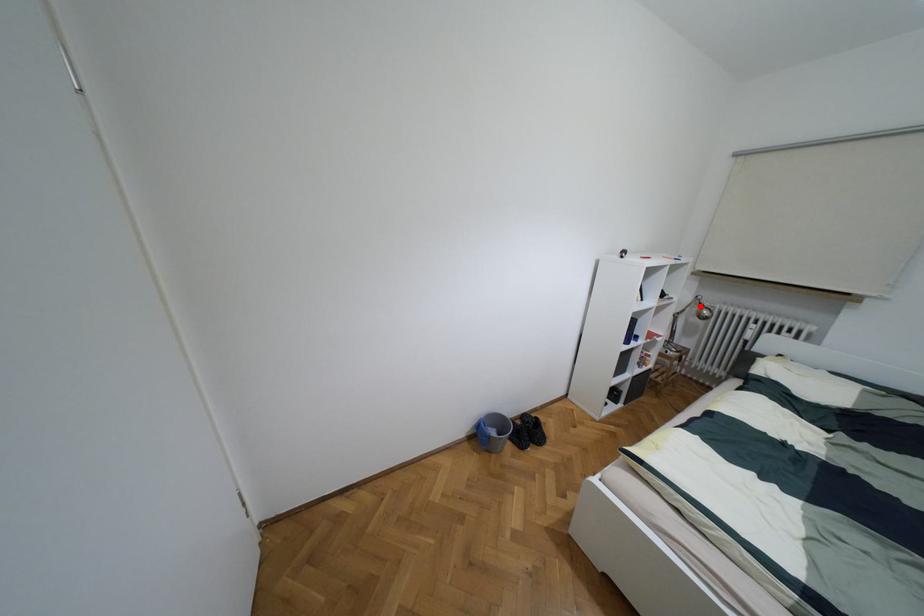
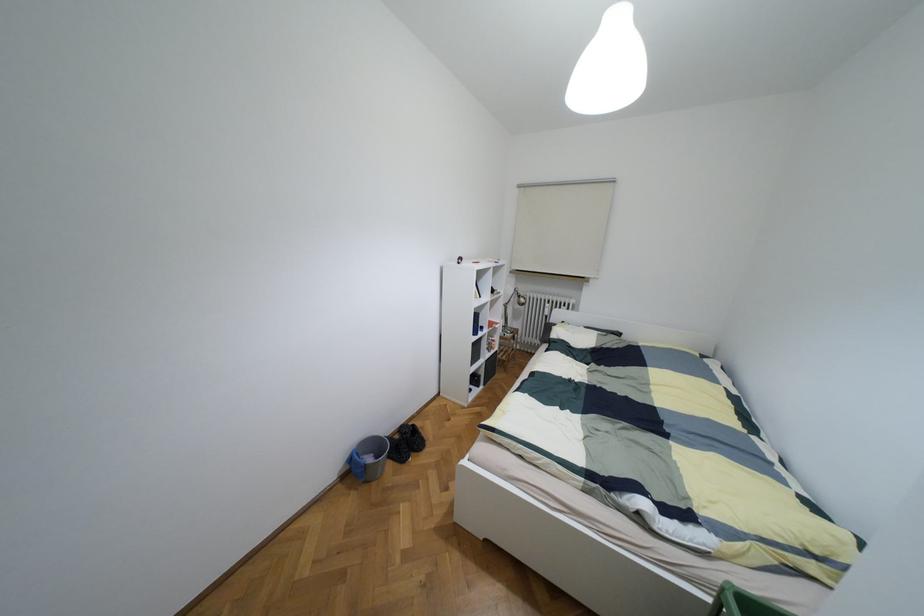
Locate, in the second image, the point that corresponds to the highlighted location in the first image.

(517, 296)